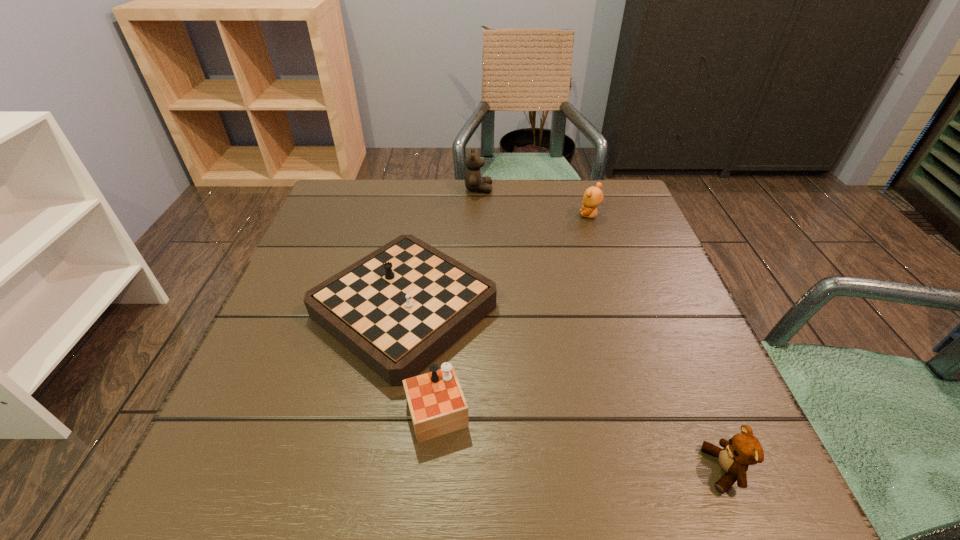
Find the location of a particular element. Image resolution: width=960 pixels, height=540 pixels. free space located 0.050m on the face of the second teddy bear from right to left is located at coordinates (561, 215).

Find the location of a particular element. free space located on the face of the second teddy bear from right to left is located at coordinates (475, 215).

Where is `vacant space located on the front-facing side of the nearest teddy bear`? This screenshot has width=960, height=540. vacant space located on the front-facing side of the nearest teddy bear is located at coordinates (577, 469).

The width and height of the screenshot is (960, 540). Identify the location of vacant space situated on the front-facing side of the nearest teddy bear. (590, 469).

The height and width of the screenshot is (540, 960). Identify the location of vacant space situated 0.050m on the front-facing side of the nearest teddy bear. (672, 469).

The width and height of the screenshot is (960, 540). I want to click on object at the near edge, so click(x=743, y=449).

The width and height of the screenshot is (960, 540). Find the location of `object that is at the left edge`. object that is at the left edge is located at coordinates (397, 309).

This screenshot has width=960, height=540. Identify the location of object at the far right corner. (593, 196).

The width and height of the screenshot is (960, 540). I want to click on object present at the near right corner, so click(743, 449).

In order to click on free spot at the far edge of the desktop in this screenshot , I will do `click(468, 203)`.